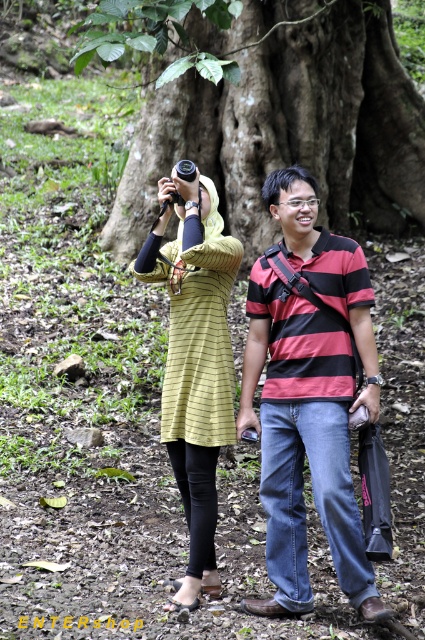
Question: Considering the relative positions of green rough bark tree at center and yellow striped dress at upper left in the image provided, where is green rough bark tree at center located with respect to yellow striped dress at upper left?

Choices:
 (A) left
 (B) right

Answer: (B)

Question: Which point appears closest to the camera in this image?

Choices:
 (A) (135, 170)
 (B) (220, 253)

Answer: (B)

Question: Which point is closer to the camera?

Choices:
 (A) striped cotton shirt at center
 (B) yellow striped dress at upper left
 (C) green rough bark tree at center

Answer: (A)

Question: Can you confirm if striped cotton shirt at center is bigger than yellow striped dress at upper left?

Choices:
 (A) yes
 (B) no

Answer: (A)

Question: From the image, what is the correct spatial relationship of green rough bark tree at center in relation to yellow striped dress at upper left?

Choices:
 (A) below
 (B) above

Answer: (B)

Question: Among these objects, which one is farthest from the camera?

Choices:
 (A) striped cotton shirt at center
 (B) yellow striped dress at upper left
 (C) green rough bark tree at center

Answer: (C)